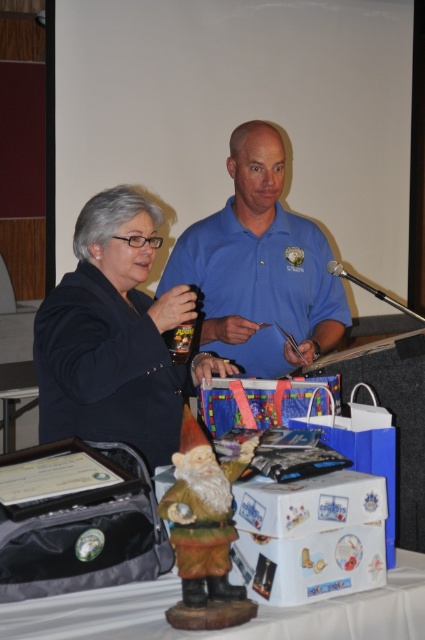
Question: Where is blue cotton shirt at center located in relation to wooden gnome at center in the image?

Choices:
 (A) left
 (B) right

Answer: (B)

Question: Which of the following is the farthest from the observer?

Choices:
 (A) click(101, 387)
 (B) click(350, 600)

Answer: (A)

Question: Which of the following is the closest to the observer?

Choices:
 (A) blue cotton shirt at center
 (B) matte black jacket at center

Answer: (B)

Question: Can you confirm if matte black jacket at center is positioned below wooden gnome at center?

Choices:
 (A) no
 (B) yes

Answer: (A)

Question: Which point appears closest to the camera in this image?

Choices:
 (A) (79, 221)
 (B) (314, 224)
 (C) (334, 624)
 (D) (175, 561)

Answer: (C)

Question: Is matte black jacket at center positioned in front of polished wood gnome at center?

Choices:
 (A) no
 (B) yes

Answer: (A)